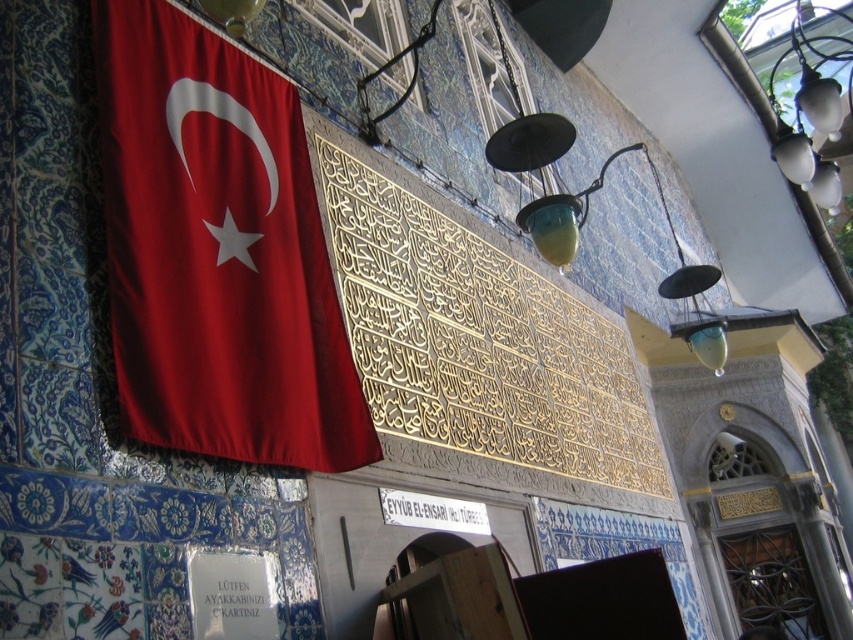
You are standing at the entrance of the building and want to place a new decorative item between the velvet red flag at left and the white metallic sign at center. If the item is 10 feet long, will there be enough space between them?

The velvet red flag at left is 27.50 feet from the white metallic sign at center. Since the item is only 10 feet long, there is sufficient space between them to place it.

You are standing in front of the building with intricate tilework and decorative elements. There are two points marked on the wall. The first point is at position point (180,298) and the second is at point (810,74). Which of these two points is closer to you?

Point (180,298) is closer to the viewer than point (810,74).